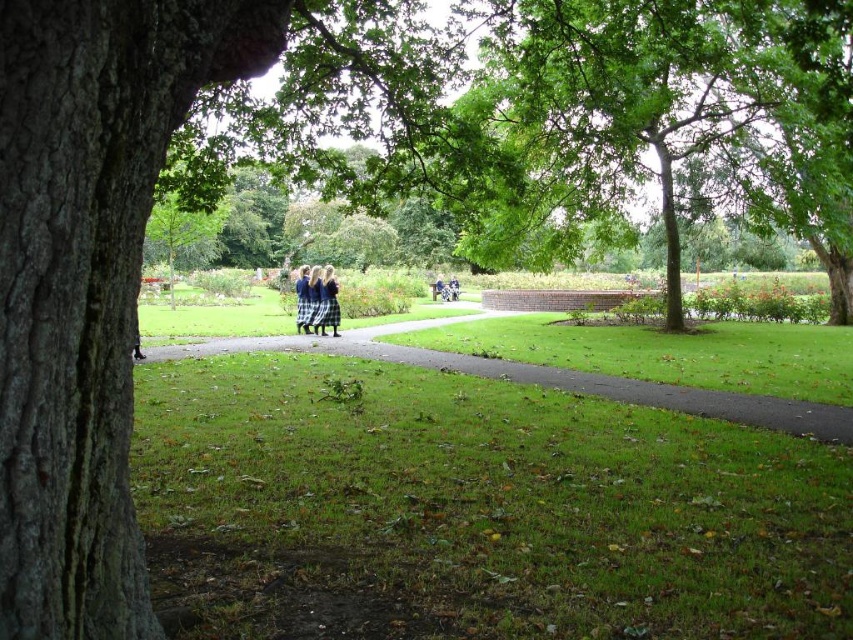
Question: Which of the following is the farthest from the observer?

Choices:
 (A) blue plaid skirt at center
 (B) green grass at center

Answer: (A)

Question: Which object appears farthest from the camera in this image?

Choices:
 (A) silk blue dress at center
 (B) blue plaid skirt at center
 (C) dark blue skirt at center
 (D) green grass at center

Answer: (B)

Question: Does dark blue skirt at center appear on the left side of blue plaid skirt at center?

Choices:
 (A) no
 (B) yes

Answer: (A)

Question: Is dark blue skirt at center positioned behind blue plaid skirt at center?

Choices:
 (A) no
 (B) yes

Answer: (A)

Question: Among these points, which one is farthest from the camera?

Choices:
 (A) (300, 326)
 (B) (508, 362)
 (C) (323, 296)

Answer: (A)

Question: Does green grass at center appear on the right side of silk blue dress at center?

Choices:
 (A) yes
 (B) no

Answer: (A)